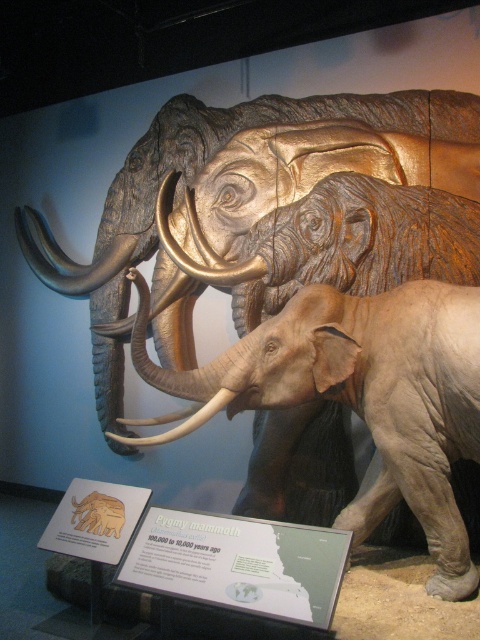
Looking at this image, is matte gray elephant at center closer to the viewer compared to white ivory tusk at center?

That is False.

Is point (255, 488) more distant than point (203, 412)?

Yes, it is.

Locate an element on the screen. This screenshot has height=640, width=480. matte gray elephant at center is located at coordinates (337, 243).